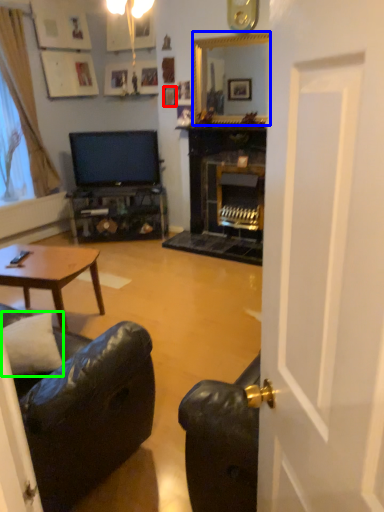
Question: Which object is positioned closest to picture frame (highlighted by a red box)? Select from fireplace (highlighted by a blue box) and pillow (highlighted by a green box).

Choices:
 (A) fireplace
 (B) pillow

Answer: (A)